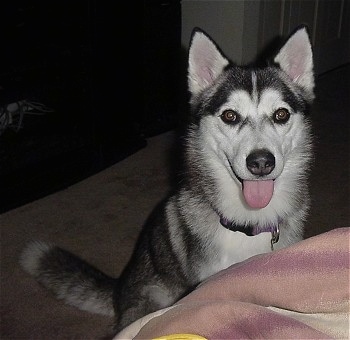
In order to click on door in this screenshot , I will do click(x=315, y=30).